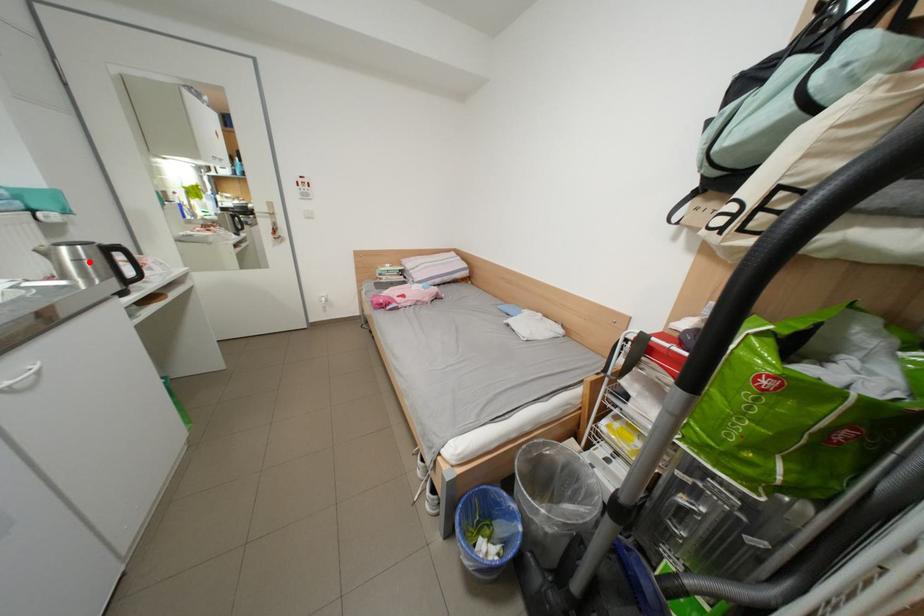
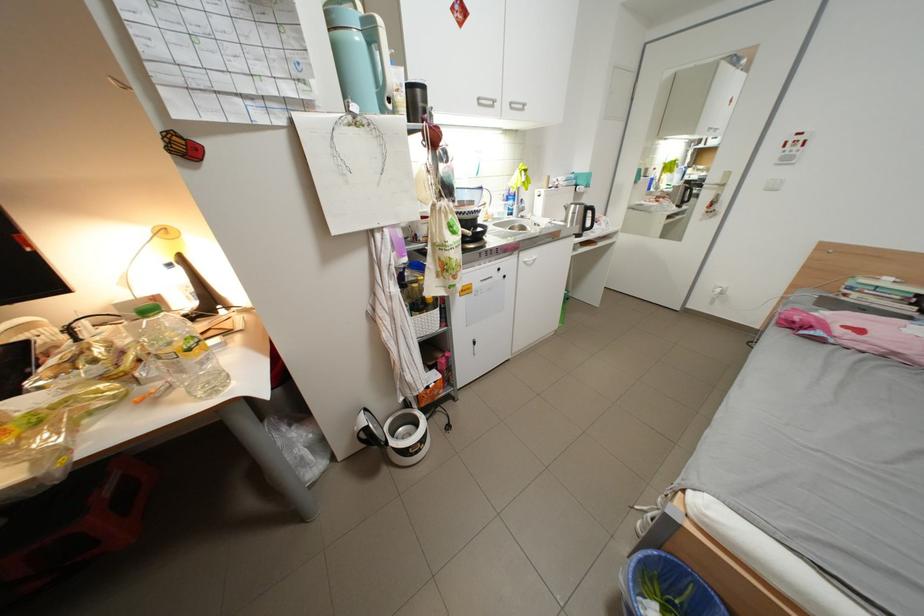
Question: A red point is marked in image1. In image2, is the corresponding 3D point closer to the camera or farther? Reply with the corresponding letter.

Choices:
 (A) The corresponding 3D point is closer.
 (B) The corresponding 3D point is farther.

Answer: (A)